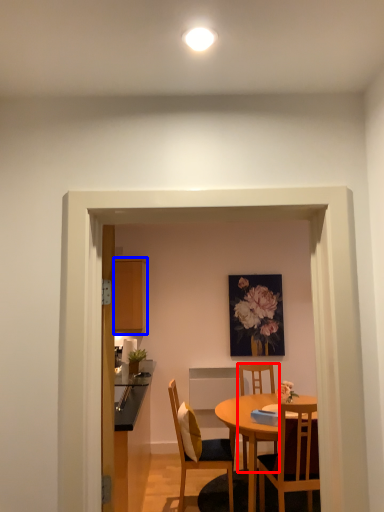
Question: Which object is closer to the camera taking this photo, chair (highlighted by a red box) or cabinetry (highlighted by a blue box)?

Choices:
 (A) chair
 (B) cabinetry

Answer: (A)